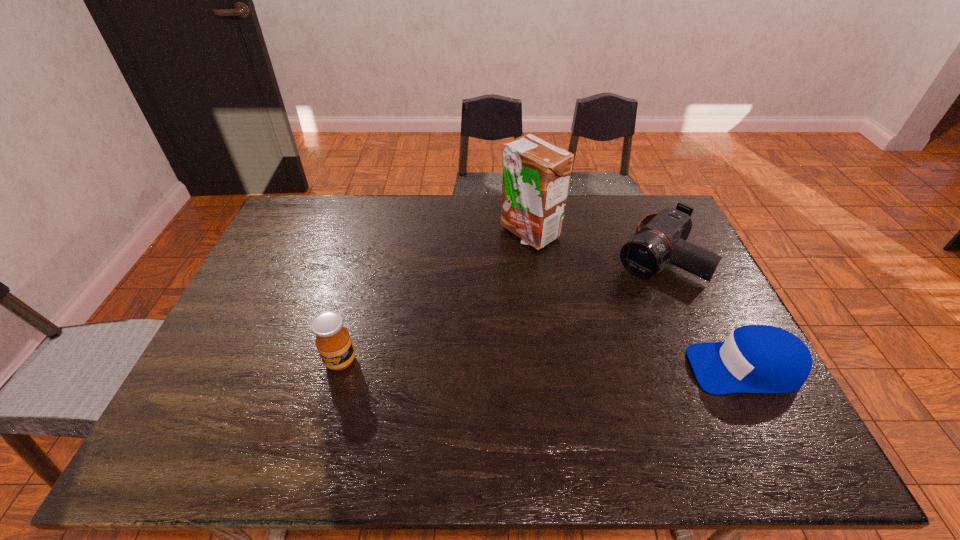
Identify the location of free area in between the tallest object and the baseball cap. coord(636,300).

In order to click on blank region between the camcorder and the honey in this screenshot , I will do `click(497, 308)`.

Locate an element on the screen. free spot between the leftmost object and the baseball cap is located at coordinates (542, 364).

At what (x,y) coordinates should I click in order to perform the action: click on free space that is in between the camcorder and the leftmost object. Please return your answer as a coordinate pair (x, y). Looking at the image, I should click on click(497, 308).

Locate an element on the screen. empty location between the tallest object and the camcorder is located at coordinates (591, 244).

This screenshot has width=960, height=540. I want to click on free area in between the honey and the third object from right to left, so click(435, 297).

Where is `blank region between the baseball cap and the third object from right to left`? The width and height of the screenshot is (960, 540). blank region between the baseball cap and the third object from right to left is located at coordinates coord(636,300).

This screenshot has width=960, height=540. Identify the location of the closest object to the leftmost object. (536, 174).

This screenshot has width=960, height=540. I want to click on object that stands as the second closest to the second tallest object, so click(659, 236).

What are the coordinates of `free space that satisfies the following two spatial constraints: 1. on the front side of the baseball cap; 2. on the front-facing side of the camcorder` in the screenshot? It's located at (703, 368).